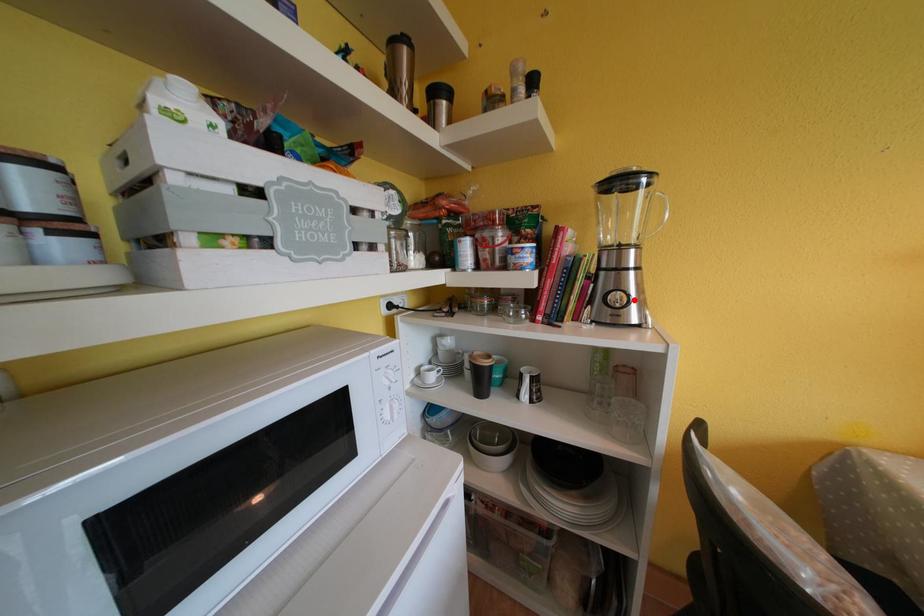
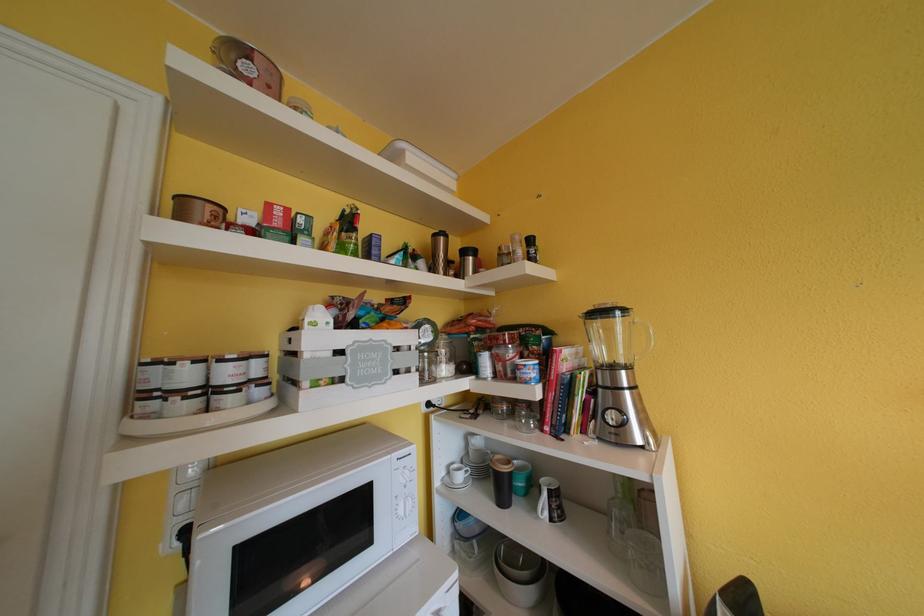
Locate, in the second image, the point that corresponds to the highlighted location in the first image.

(633, 418)